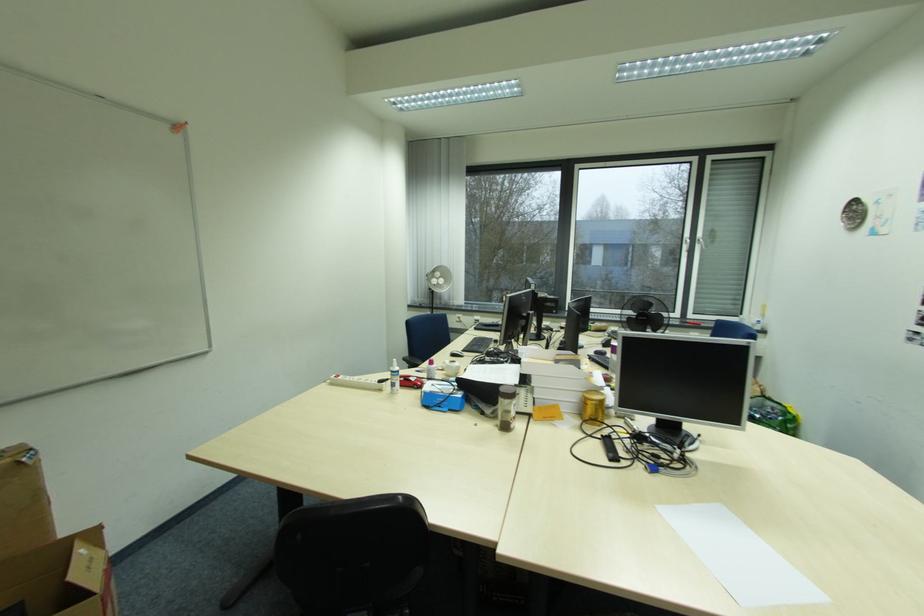
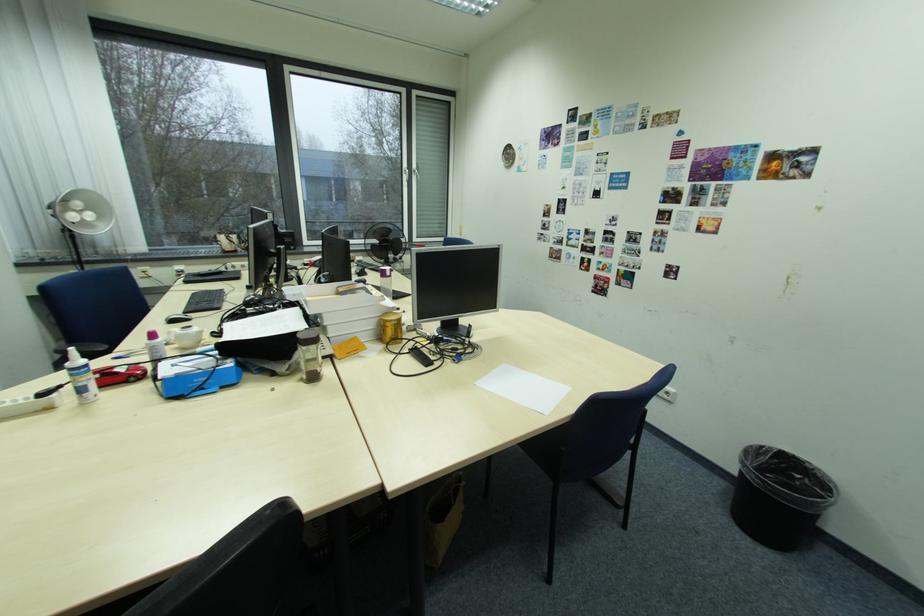
The point at (601, 418) is marked in the first image. Where is the corresponding point in the second image?

(400, 339)